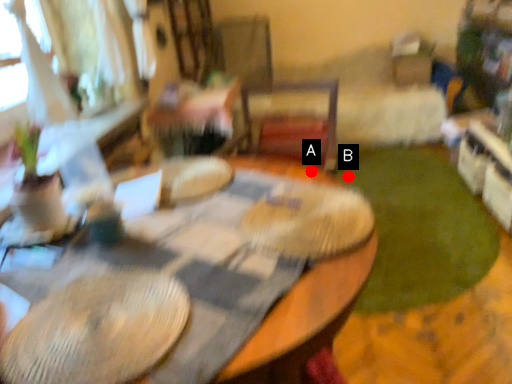
Question: Two points are circled on the image, labeled by A and B beside each circle. Which point is closer to the camera taking this photo?

Choices:
 (A) A is closer
 (B) B is closer

Answer: (A)